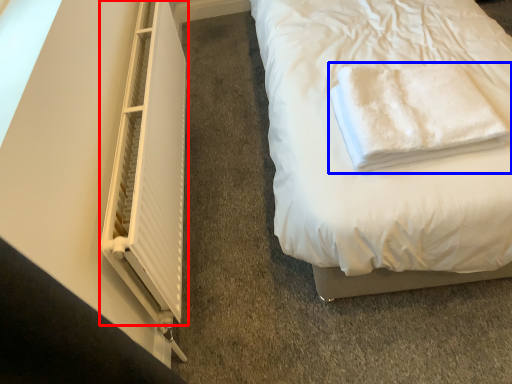
Question: Which object appears farthest to the camera in this image, window (highlighted by a red box) or towel (highlighted by a blue box)?

Choices:
 (A) window
 (B) towel

Answer: (B)